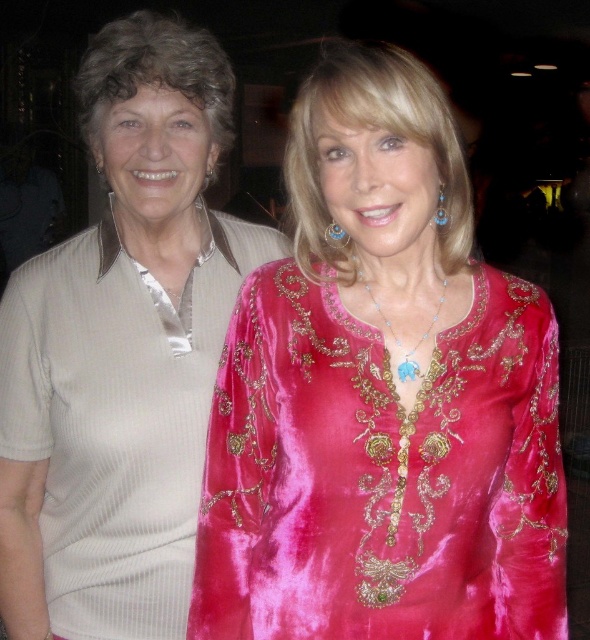
Does velvet pink dress at center have a larger size compared to beige ribbed sweater at left?

Actually, velvet pink dress at center might be smaller than beige ribbed sweater at left.

Is velvet pink dress at center wider than beige ribbed sweater at left?

Indeed, velvet pink dress at center has a greater width compared to beige ribbed sweater at left.

Find the location of a particular element. The width and height of the screenshot is (590, 640). velvet pink dress at center is located at coordinates (381, 474).